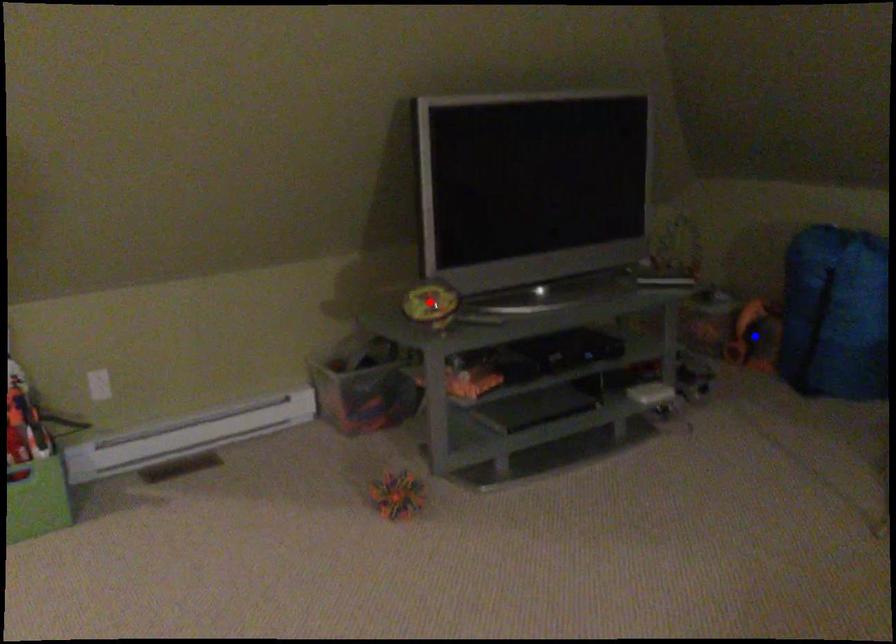
Question: Two points are marked on the image. Which point is closer to the camera?

Choices:
 (A) Blue point is closer.
 (B) Red point is closer.

Answer: (B)